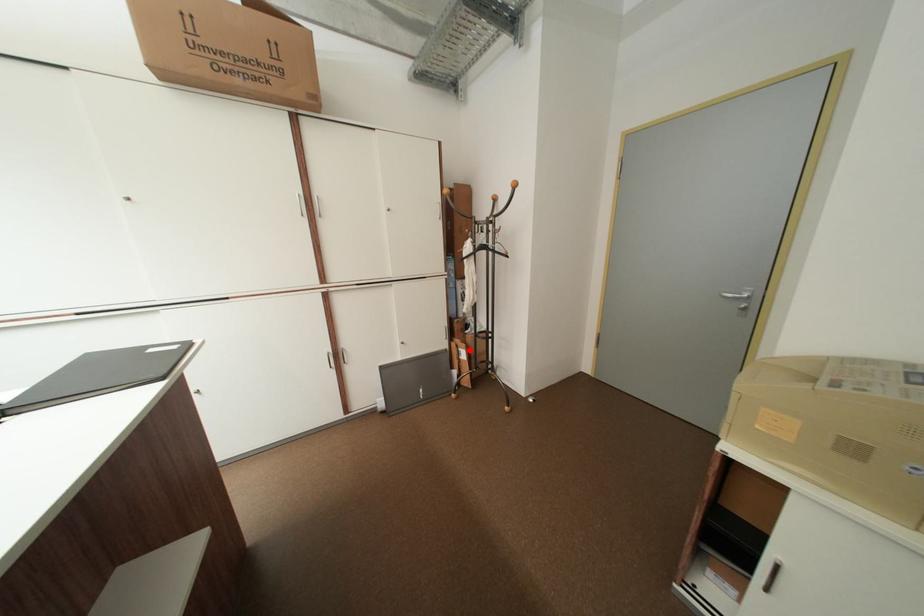
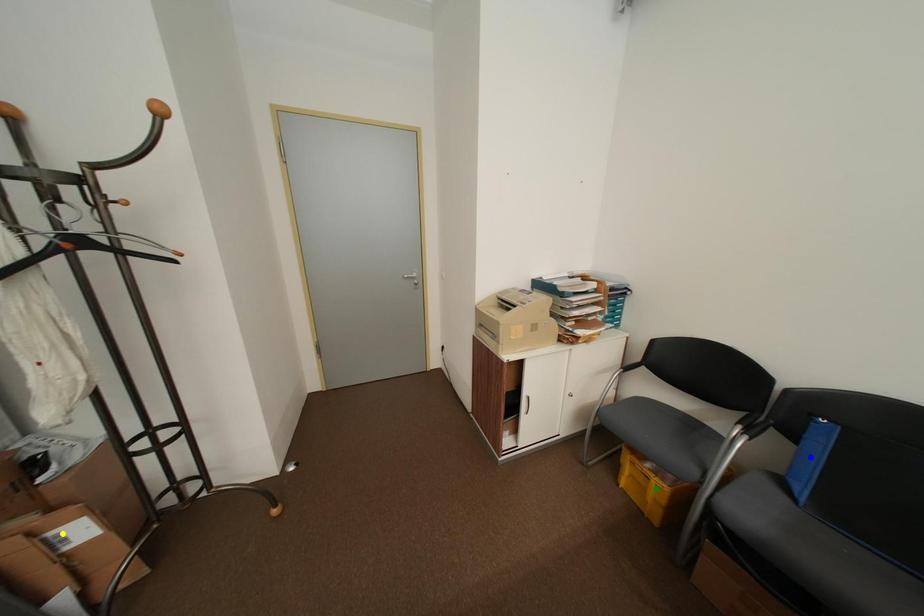
Question: I am providing you with two images of the same scene from different viewpoints. A red point is marked on the first image. You are given multiple points on the second image. Which spot in image 2 lines up with the point in image 1?

Choices:
 (A) green point
 (B) yellow point
 (C) blue point

Answer: (B)